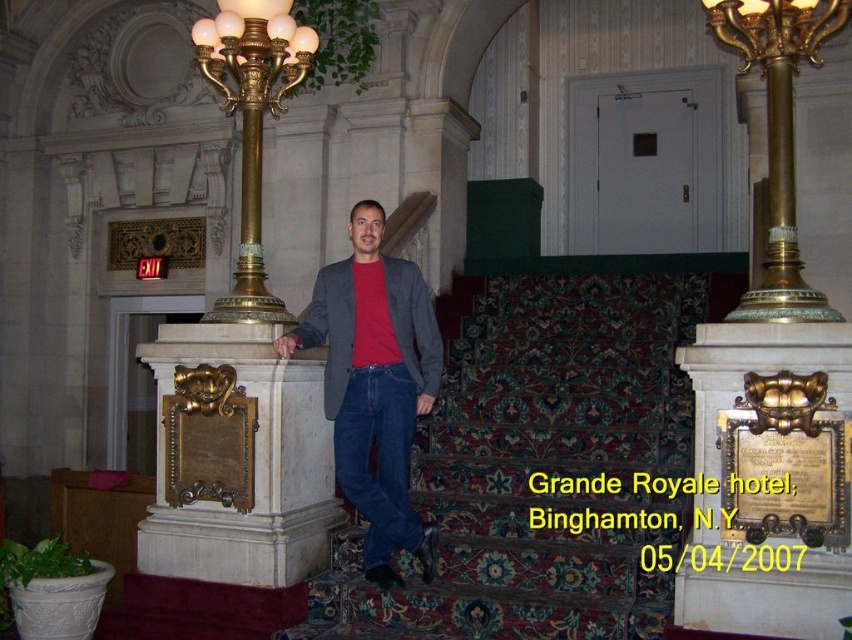
Does matte gray blazer at center appear on the left side of gold-bronze lamp post at left?

No, matte gray blazer at center is not to the left of gold-bronze lamp post at left.

What do you see at coordinates (375, 385) in the screenshot?
I see `matte gray blazer at center` at bounding box center [375, 385].

This screenshot has width=852, height=640. Find the location of `matte gray blazer at center`. matte gray blazer at center is located at coordinates (375, 385).

Which of these two, gold polished brass at right or gold-bronze lamp post at left, stands taller?

gold-bronze lamp post at left

Consider the image. Is gold polished brass at right wider than gold-bronze lamp post at left?

No, gold polished brass at right is not wider than gold-bronze lamp post at left.

Does point (786, 221) lie in front of point (240, 176)?

Yes, it is.

Identify the location of gold polished brass at right. (779, 136).

Can you confirm if carpeted stairs at center is wider than matte gray blazer at center?

Yes, carpeted stairs at center is wider than matte gray blazer at center.

From the picture: Does carpeted stairs at center have a lesser height compared to matte gray blazer at center?

Indeed, carpeted stairs at center has a lesser height compared to matte gray blazer at center.

Image resolution: width=852 pixels, height=640 pixels. I want to click on carpeted stairs at center, so click(x=540, y=461).

Where is `carpeted stairs at center`? The image size is (852, 640). carpeted stairs at center is located at coordinates (540, 461).